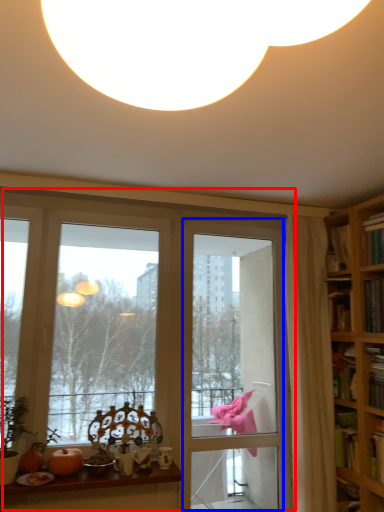
Question: Which object appears closest to the camera in this image, window (highlighted by a red box) or screen door (highlighted by a blue box)?

Choices:
 (A) window
 (B) screen door

Answer: (A)